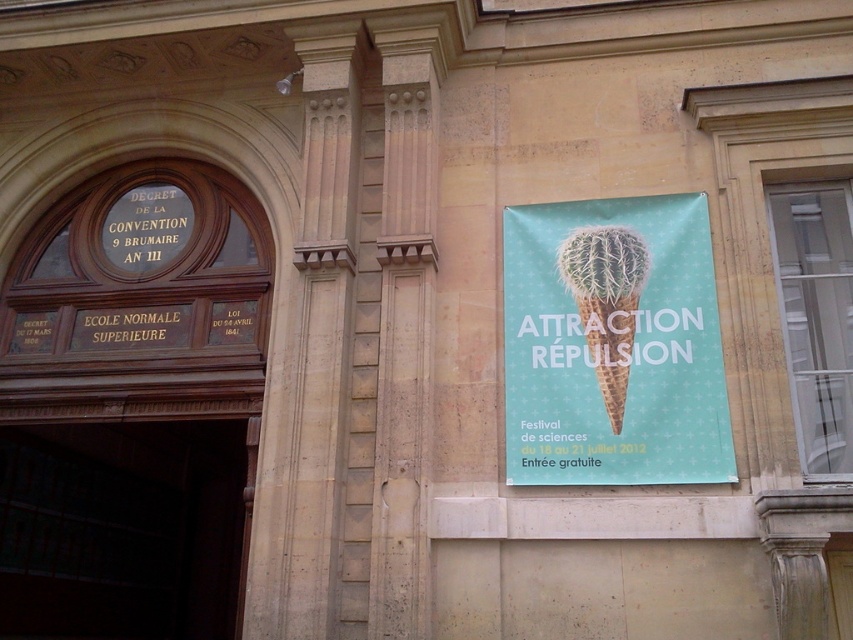
Question: Is green matte cactus cone at right to the right of green textured ice cream cone at upper right from the viewer's perspective?

Choices:
 (A) no
 (B) yes

Answer: (B)

Question: Which point appears closest to the camera in this image?

Choices:
 (A) (547, 442)
 (B) (612, 428)

Answer: (B)

Question: Which object is farther from the camera taking this photo?

Choices:
 (A) green textured ice cream cone at upper right
 (B) green matte cactus cone at right

Answer: (A)

Question: Does green matte cactus cone at right appear on the right side of green textured ice cream cone at upper right?

Choices:
 (A) yes
 (B) no

Answer: (A)

Question: Does green matte cactus cone at right have a greater width compared to green textured ice cream cone at upper right?

Choices:
 (A) yes
 (B) no

Answer: (A)

Question: Which point is closer to the camera taking this photo?

Choices:
 (A) (595, 396)
 (B) (585, 259)

Answer: (A)